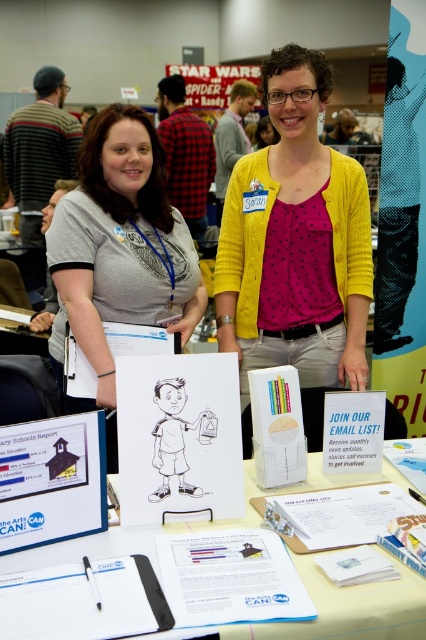
Question: Does gray cotton t-shirt at center come in front of black matte folder at lower left?

Choices:
 (A) no
 (B) yes

Answer: (A)

Question: Which is farther from the white paper at center?

Choices:
 (A) gray cotton t-shirt at center
 (B) black matte folder at lower left

Answer: (A)

Question: Can you confirm if gray cotton t-shirt at center is bigger than white paper at center?

Choices:
 (A) no
 (B) yes

Answer: (B)

Question: In this image, where is gray cotton t-shirt at center located relative to black matte folder at lower left?

Choices:
 (A) left
 (B) right

Answer: (A)

Question: Estimate the real-world distances between objects in this image. Which object is closer to the black matte folder at lower left?

Choices:
 (A) white paper at center
 (B) gray cotton t-shirt at center

Answer: (A)

Question: Which of these objects is positioned closest to the white paper at center?

Choices:
 (A) gray cotton t-shirt at center
 (B) black matte folder at lower left

Answer: (B)